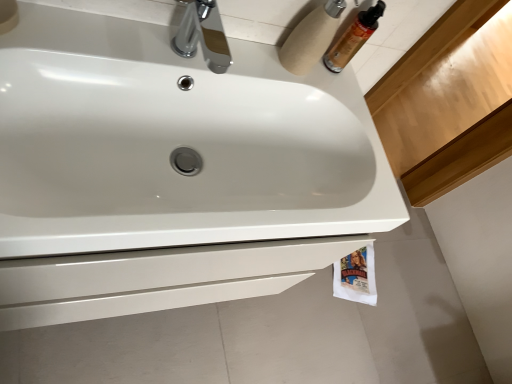
The image size is (512, 384). Identify the location of empty space that is in between chrome metallic faucet at upper center and white cardboard toilet paper at upper right, which is the 2th toilet paper from right to left. (249, 54).